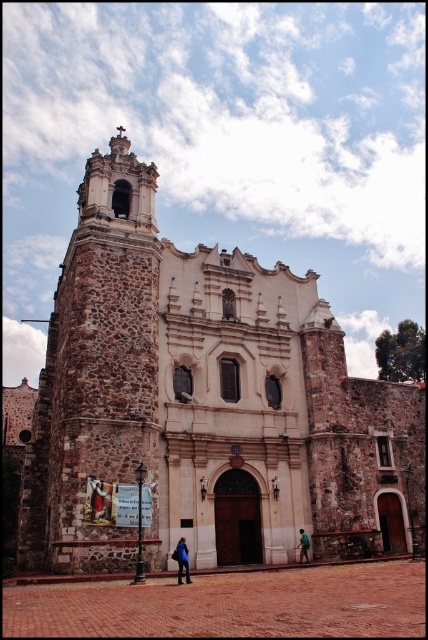
You are standing in front of the historic church and notice the stone church at center and the blue fabric at lower center. Which object is taller?

The stone church at center is taller than the blue fabric at lower center.

You are standing in front of the historic church described. You notice a specific point marked at coordinates point (106,509). If you want to touch this point with a 30 meter long pole, will the pole reach it?

The distance between you and point (106,509) is 38.98 meters. Since the pole is only 30 meters long, it will not reach the point.